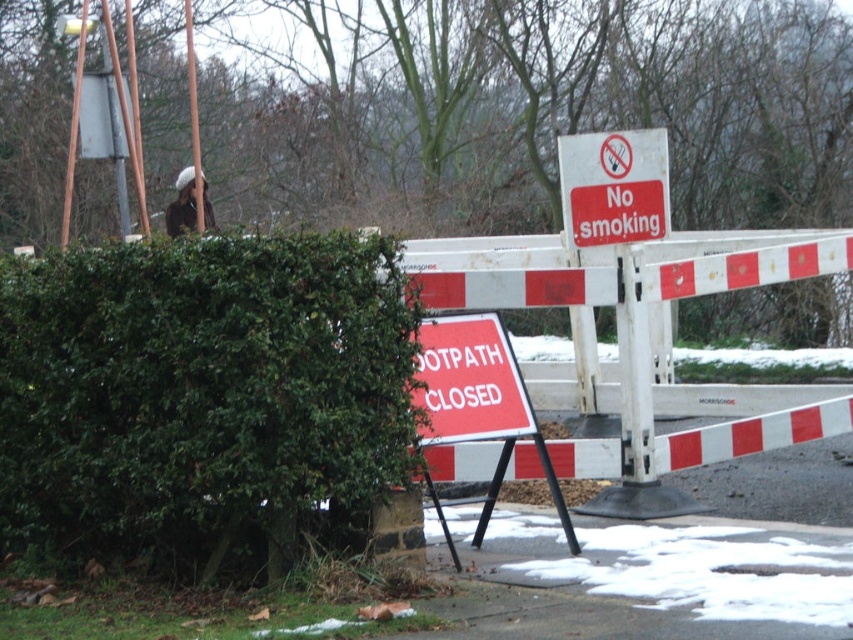
Question: Among these objects, which one is farthest from the camera?

Choices:
 (A) red plastic sign at upper center
 (B) red plastic sign at center

Answer: (A)

Question: Considering the real-world distances, which object is closest to the green leafy hedge at left?

Choices:
 (A) red plastic sign at center
 (B) brushed metal pole at upper center
 (C) red plastic sign at upper center

Answer: (A)

Question: Does red plastic sign at upper center have a smaller size compared to brushed metal pole at upper center?

Choices:
 (A) no
 (B) yes

Answer: (B)

Question: Is green leafy hedge at left to the left of red plastic sign at center from the viewer's perspective?

Choices:
 (A) yes
 (B) no

Answer: (A)

Question: Can you confirm if green leafy hedge at left is wider than red plastic sign at upper center?

Choices:
 (A) yes
 (B) no

Answer: (A)

Question: Considering the real-world distances, which object is farthest from the red plastic sign at center?

Choices:
 (A) green leafy hedge at left
 (B) red plastic sign at upper center
 (C) brushed metal pole at upper center

Answer: (C)